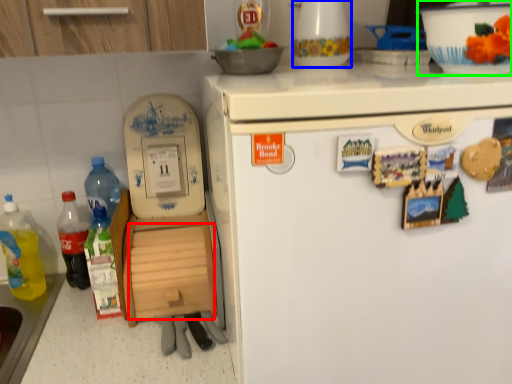
Question: Which object is the closest to the drawer (highlighted by a red box)? Choose among these: appliance (highlighted by a blue box) or bowl (highlighted by a green box).

Choices:
 (A) appliance
 (B) bowl

Answer: (A)